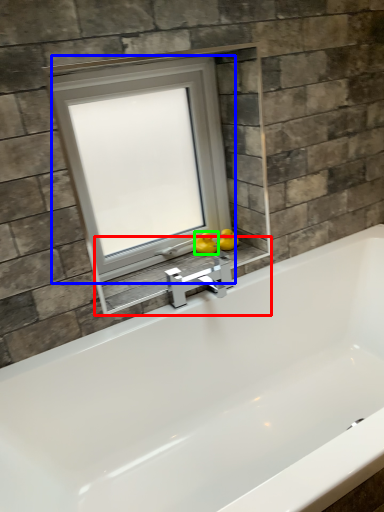
Question: Which is nearer to the window sill (highlighted by a red box)? window (highlighted by a blue box) or duck (highlighted by a green box).

Choices:
 (A) window
 (B) duck

Answer: (B)